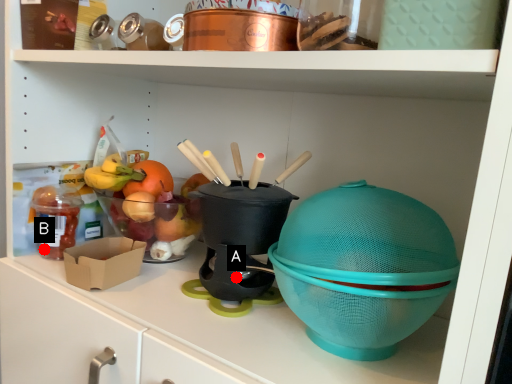
Question: Two points are circled on the image, labeled by A and B beside each circle. Which point is closer to the camera taking this photo?

Choices:
 (A) A is closer
 (B) B is closer

Answer: (A)